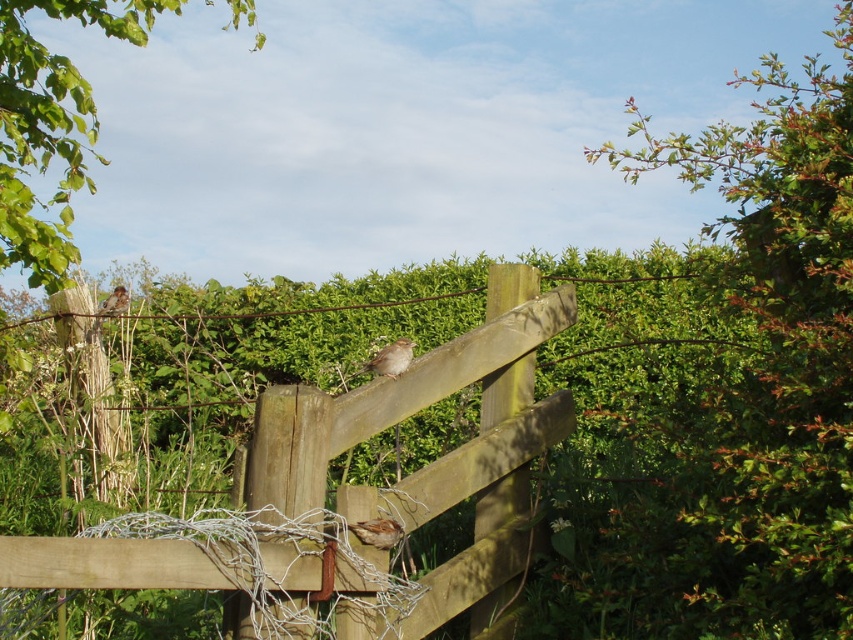
Consider the image. Does brown speckled sparrow at center appear on the left side of brown matte sparrow at upper left?

No, brown speckled sparrow at center is not to the left of brown matte sparrow at upper left.

Does point (393, 538) lie in front of point (111, 305)?

Yes.

Image resolution: width=853 pixels, height=640 pixels. I want to click on brown speckled sparrow at center, so click(x=376, y=532).

Does wooden fence at center have a larger size compared to brown speckled sparrow at center?

Indeed, wooden fence at center has a larger size compared to brown speckled sparrow at center.

Between wooden fence at center and brown speckled sparrow at center, which one is positioned lower?

wooden fence at center

Describe the element at coordinates (427, 465) in the screenshot. Image resolution: width=853 pixels, height=640 pixels. I see `wooden fence at center` at that location.

I want to click on wooden fence at center, so click(x=427, y=465).

Is wooden fence at center wider than brown matte sparrow at upper left?

Yes, wooden fence at center is wider than brown matte sparrow at upper left.

Who is more forward, (x=321, y=401) or (x=93, y=326)?

Point (x=321, y=401) is in front.

Identify the location of wooden fence at center. (427, 465).